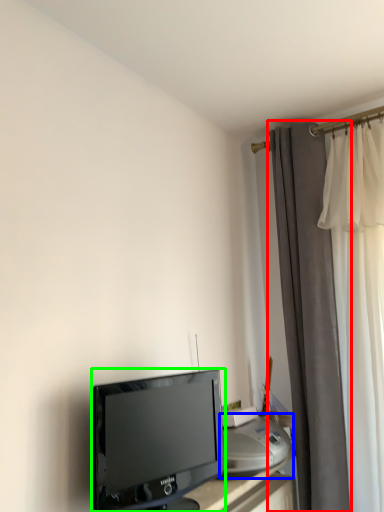
Question: Estimate the real-world distances between objects in this image. Which object is farther from curtain (highlighted by a red box), printer (highlighted by a blue box) or television (highlighted by a green box)?

Choices:
 (A) printer
 (B) television

Answer: (B)